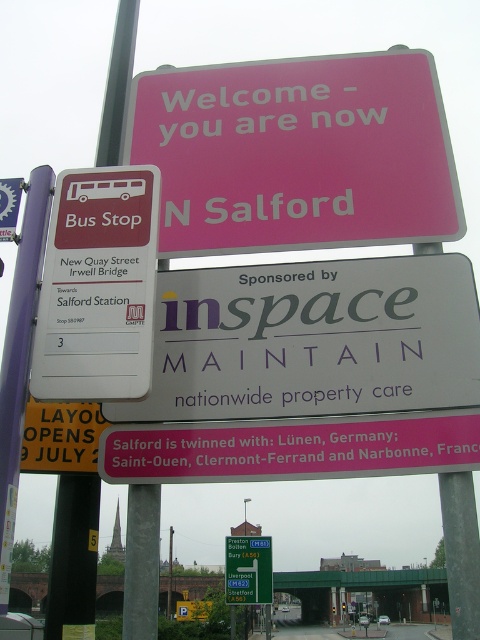
You are standing at a bus stop and need to find the pole to hold onto while the bus is moving. Which object between the metallic pole at left and the green plastic bus stop sign at upper left should you grab?

The metallic pole at left is smaller in size compared to the green plastic bus stop sign at upper left, so you should grab the metallic pole at left since it is more likely to be a handrail.

You are standing at the bus stop and want to check the schedule for the next bus. The metallic pole at left is blocking your view of the green plastic bus stop sign at upper left. Can you move around the pole to see the sign?

The metallic pole at left is in front of the green plastic bus stop sign at upper left, so moving around the pole would allow you to see the sign.